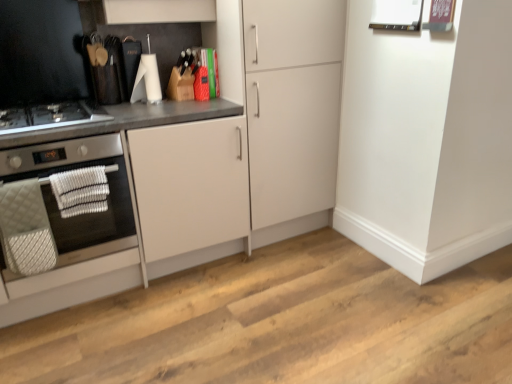
Question: Can we say white matte cabinet at center, the second cabinetry positioned from the left, lies outside black glass gas stove at left?

Choices:
 (A) no
 (B) yes

Answer: (B)

Question: Is white matte cabinet at center, the second cabinetry positioned from the left, smaller than black glass gas stove at left?

Choices:
 (A) yes
 (B) no

Answer: (B)

Question: Would you consider white matte cabinet at center, the second cabinetry positioned from the left, to be distant from black glass gas stove at left?

Choices:
 (A) no
 (B) yes

Answer: (A)

Question: Can you confirm if white matte cabinet at center, which is the first cabinetry from right to left, is bigger than black glass gas stove at left?

Choices:
 (A) yes
 (B) no

Answer: (A)

Question: Can you confirm if white matte cabinet at center, the second cabinetry positioned from the left, is positioned to the right of black glass gas stove at left?

Choices:
 (A) no
 (B) yes

Answer: (B)

Question: In the image, is black glass gas stove at left positioned in front of or behind white matte cabinet at left, the 2th cabinetry when ordered from right to left?

Choices:
 (A) behind
 (B) front

Answer: (A)

Question: Based on their positions, is black glass gas stove at left located to the left or right of white matte cabinet at left, the 2th cabinetry when ordered from right to left?

Choices:
 (A) right
 (B) left

Answer: (B)

Question: Looking at their shapes, would you say black glass gas stove at left is wider or thinner than white matte cabinet at left, the 2th cabinetry when ordered from right to left?

Choices:
 (A) wide
 (B) thin

Answer: (B)

Question: Is point tap(5, 130) closer or farther from the camera than point tap(318, 208)?

Choices:
 (A) closer
 (B) farther

Answer: (A)

Question: Is white matte cabinet at center, which is the first cabinetry from right to left, taller or shorter than silver metallic oven at left?

Choices:
 (A) tall
 (B) short

Answer: (A)

Question: In the image, is white matte cabinet at center, which is the first cabinetry from right to left, positioned in front of or behind silver metallic oven at left?

Choices:
 (A) front
 (B) behind

Answer: (B)

Question: Considering the positions of point (301, 162) and point (40, 165), is point (301, 162) closer or farther from the camera than point (40, 165)?

Choices:
 (A) closer
 (B) farther

Answer: (B)

Question: Is white matte cabinet at center, the second cabinetry positioned from the left, inside the boundaries of silver metallic oven at left, or outside?

Choices:
 (A) outside
 (B) inside

Answer: (A)

Question: Considering the positions of silver metallic oven at left and white matte cabinet at center, the second cabinetry positioned from the left, in the image, is silver metallic oven at left wider or thinner than white matte cabinet at center, the second cabinetry positioned from the left,?

Choices:
 (A) wide
 (B) thin

Answer: (B)

Question: From the image's perspective, is silver metallic oven at left positioned above or below white matte cabinet at center, the second cabinetry positioned from the left?

Choices:
 (A) below
 (B) above

Answer: (A)